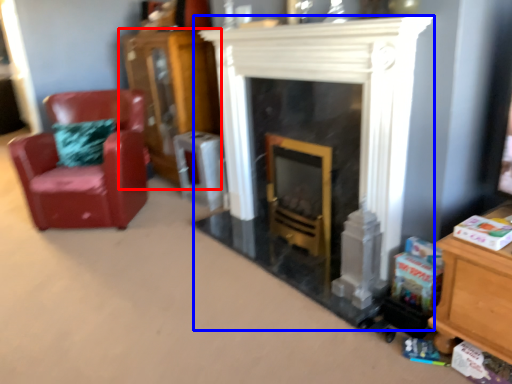
Question: Which of the following is the farthest to the observer, dresser (highlighted by a red box) or fireplace (highlighted by a blue box)?

Choices:
 (A) dresser
 (B) fireplace

Answer: (A)